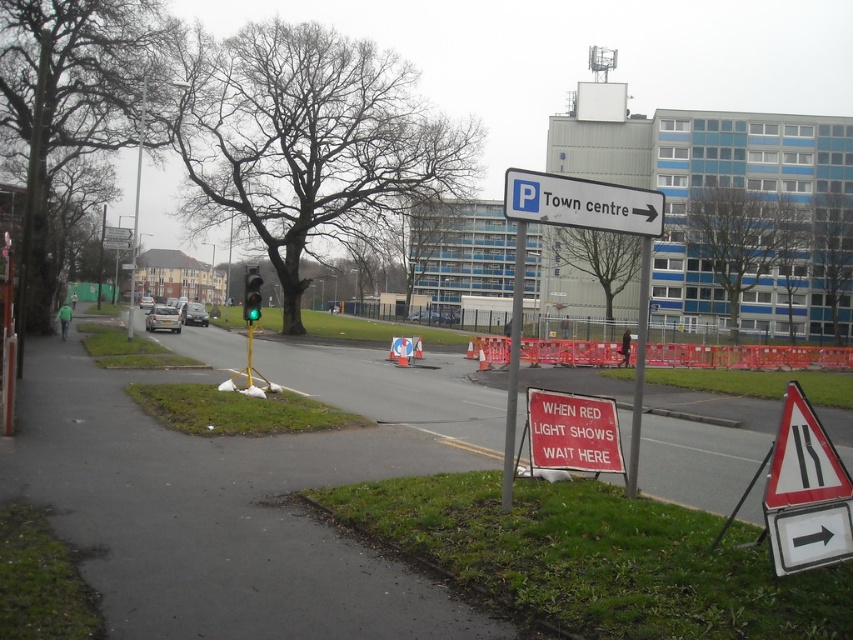
Question: Which point is farther from the camera taking this photo?

Choices:
 (A) (613, 426)
 (B) (788, 474)
 (C) (637, 330)
 (D) (508, 454)

Answer: (A)

Question: Among these objects, which one is farthest from the camera?

Choices:
 (A) black reflective triangle at lower right
 (B) red matte sign at lower center
 (C) green glass traffic light at center

Answer: (C)

Question: Does red matte sign at lower center have a greater width compared to metallic pole at center?

Choices:
 (A) yes
 (B) no

Answer: (B)

Question: Can you confirm if black reflective triangle at lower right is positioned to the left of green glass traffic light at center?

Choices:
 (A) yes
 (B) no

Answer: (B)

Question: Estimate the real-world distances between objects in this image. Which object is farther from the gray metallic pole at center?

Choices:
 (A) metallic pole at center
 (B) black reflective triangle at lower right
 (C) green glass traffic light at center
 (D) white plastic sign at upper center

Answer: (C)

Question: Is black reflective triangle at lower right behind metallic pole at center?

Choices:
 (A) no
 (B) yes

Answer: (A)